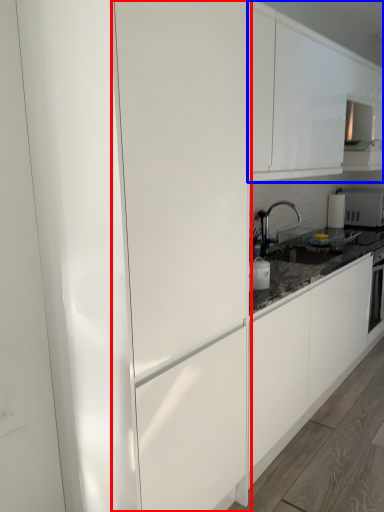
Question: Which of the following is the farthest to the observer, glass door (highlighted by a red box) or cabinetry (highlighted by a blue box)?

Choices:
 (A) glass door
 (B) cabinetry

Answer: (B)